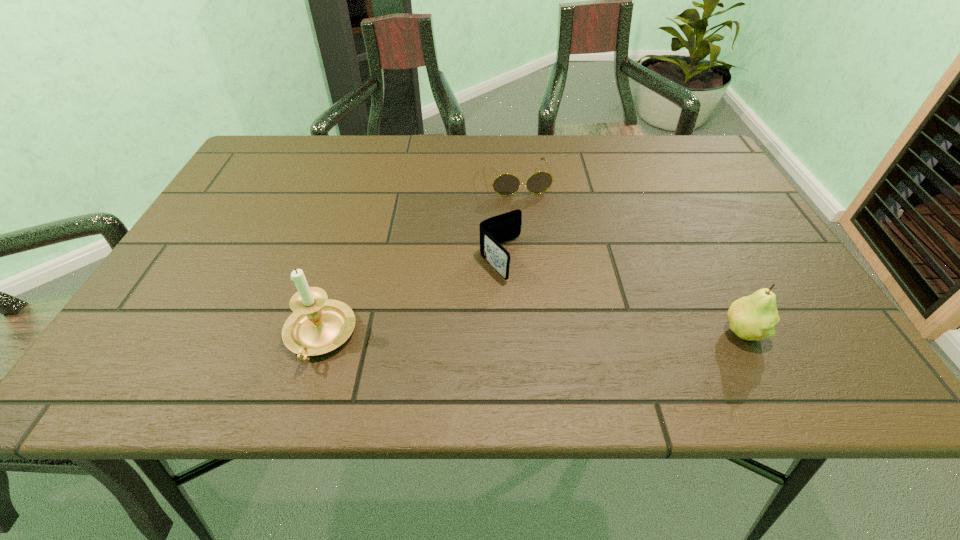
The height and width of the screenshot is (540, 960). In the image, there is a desktop. In order to click on vacant space at the near edge in this screenshot , I will do click(404, 345).

Where is `free spot at the left edge of the desktop`? The height and width of the screenshot is (540, 960). free spot at the left edge of the desktop is located at coordinates (239, 205).

Where is `vacant space at the right edge of the desktop`? This screenshot has height=540, width=960. vacant space at the right edge of the desktop is located at coordinates (709, 200).

What are the coordinates of `free space at the near right corner of the desktop` in the screenshot? It's located at (793, 327).

At what (x,y) coordinates should I click in order to perform the action: click on free space between the second tallest object and the wallet. Please return your answer as a coordinate pair (x, y). This screenshot has width=960, height=540. Looking at the image, I should click on (622, 295).

The width and height of the screenshot is (960, 540). In order to click on vacant area that lies between the farthest object and the tallest object in this screenshot , I will do `click(419, 258)`.

Image resolution: width=960 pixels, height=540 pixels. I want to click on free space between the tallest object and the second shortest object, so click(410, 298).

Locate an element on the screen. vacant area that lies between the rightmost object and the second farthest object is located at coordinates (622, 295).

In order to click on vacant area between the pear and the third nearest object in this screenshot , I will do `click(622, 295)`.

I want to click on vacant area that lies between the shortest object and the candle holder, so click(x=419, y=258).